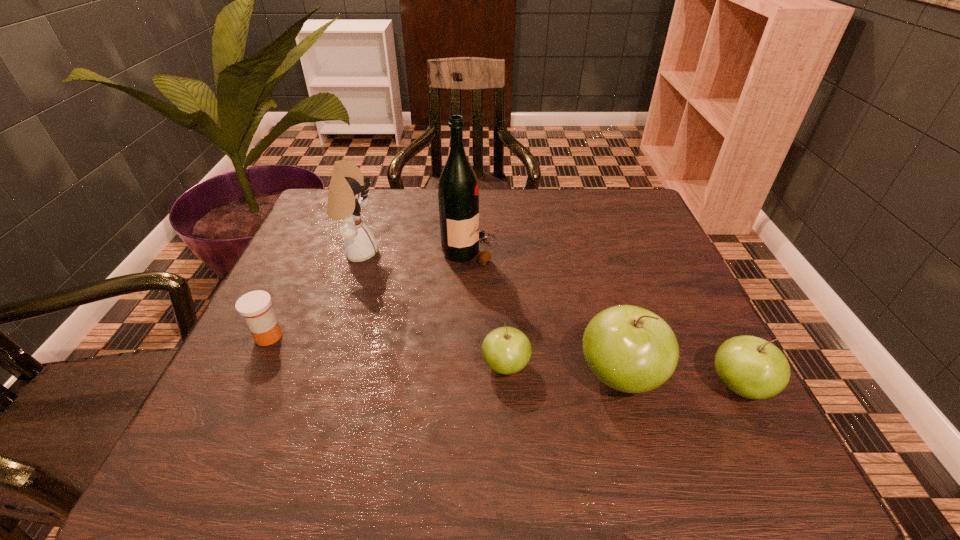
Find the location of a particular element. The image size is (960, 540). vacant space at the far edge is located at coordinates (436, 208).

The height and width of the screenshot is (540, 960). Identify the location of blank space at the near edge. (551, 386).

Locate an element on the screen. The image size is (960, 540). vacant space at the left edge of the desktop is located at coordinates (288, 279).

In the image, there is a desktop. At what (x,y) coordinates should I click in order to perform the action: click on free space at the right edge. Please return your answer as a coordinate pair (x, y). Image resolution: width=960 pixels, height=540 pixels. Looking at the image, I should click on (669, 265).

At what (x,y) coordinates should I click in order to perform the action: click on free region at the far left corner of the desktop. Please return your answer as a coordinate pair (x, y). The height and width of the screenshot is (540, 960). Looking at the image, I should click on tap(375, 196).

Locate an element on the screen. vacant area at the far right corner of the desktop is located at coordinates (659, 237).

Identify the location of unoccupied position between the leftmost object and the leftmost apple. (387, 351).

Find the location of a particular element. empty space that is in between the tallest object and the second object from right to left is located at coordinates (544, 314).

The image size is (960, 540). What are the coordinates of `free space that is in between the leftmost object and the second apple from right to left` in the screenshot? It's located at (444, 356).

Locate an element on the screen. unoccupied area between the leftmost apple and the fourth shortest object is located at coordinates pyautogui.click(x=563, y=371).